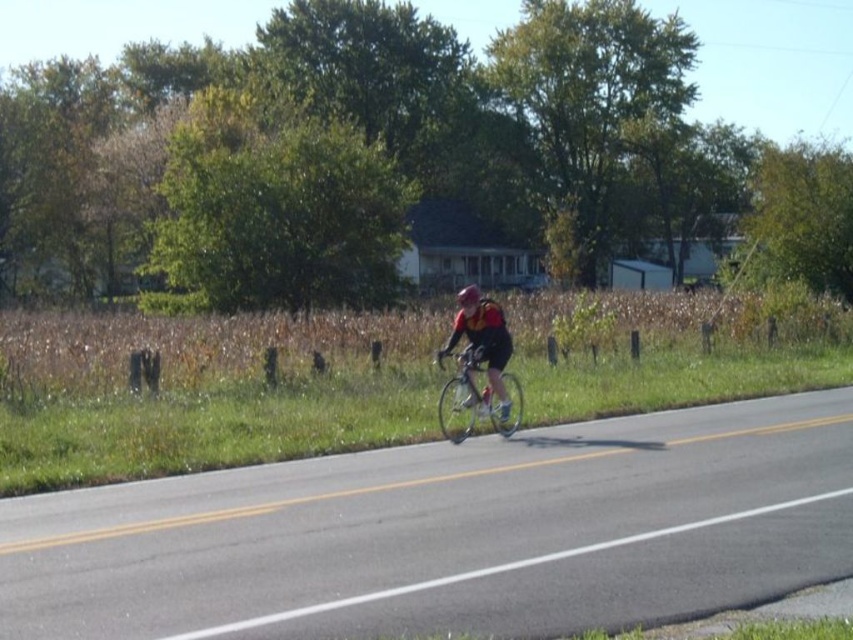
You are a delivery driver planning to overtake the cyclist on the road. The road has a double yellow line, which means no passing is allowed. However, you notice that the shiny metallic bicycle at center and the matte black cycling outfit at center have a specific spatial relationship. Can you determine if there is enough space between them to safely pass the cyclist without crossing the double yellow line?

The shiny metallic bicycle at center might be wider than matte black cycling outfit at center. Since the double yellow line prohibits passing, you should not attempt to overtake the cyclist regardless of the space between the bicycle and the outfit, as it is illegal and unsafe to cross the double yellow line.

You are a pedestrian standing on the side of the road and see the shiny metallic bicycle at center and the matte black cycling outfit at center. Which object is nearer to you?

The shiny metallic bicycle at center is closer to you than the matte black cycling outfit at center.